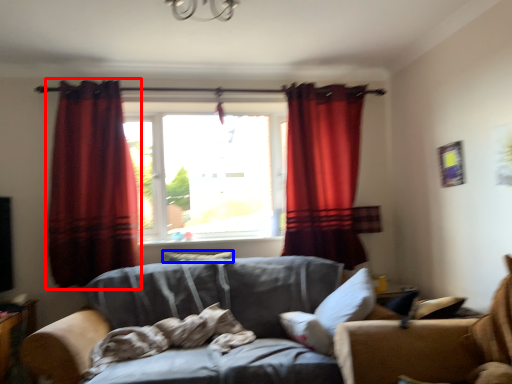
Question: Among these objects, which one is farthest to the camera, curtain (highlighted by a red box) or pillow (highlighted by a blue box)?

Choices:
 (A) curtain
 (B) pillow

Answer: (B)